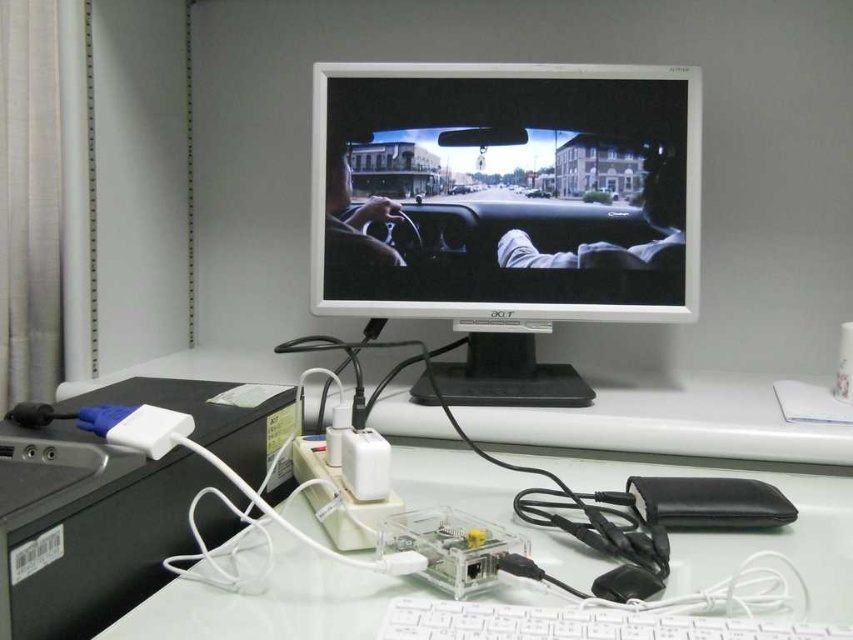
You are a delivery person who needs to place a new camera on the desk without blocking the view of the white glossy monitor at center. The camera requires a space of 1 meter in front of it. Can you place it near the power strip at bottom left corner?

The white glossy monitor at center and camera are 1.05 meters apart, so yes, placing the camera near the power strip at bottom left corner would leave enough space between the camera and the white glossy monitor at center to avoid blocking the view.

You are organizing the desk and want to place a new cable between the clear plastic electronics at center and the power strip near the bottom left corner. How much space do you have to work with?

The clear plastic electronics at center and the power strip near the bottom left corner are 54.94 centimeters apart, so you have 54.94 centimeters of space to work with when placing the new cable between them.